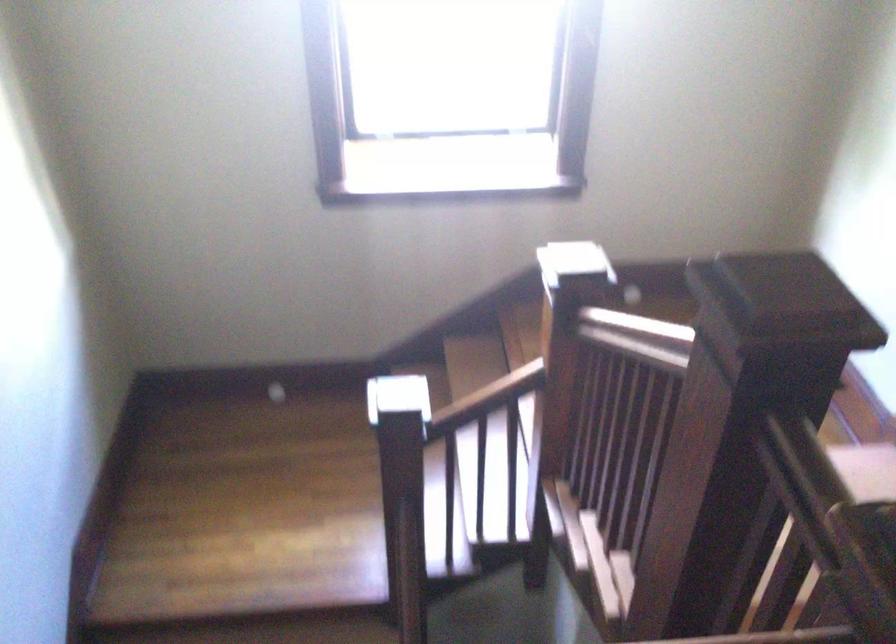
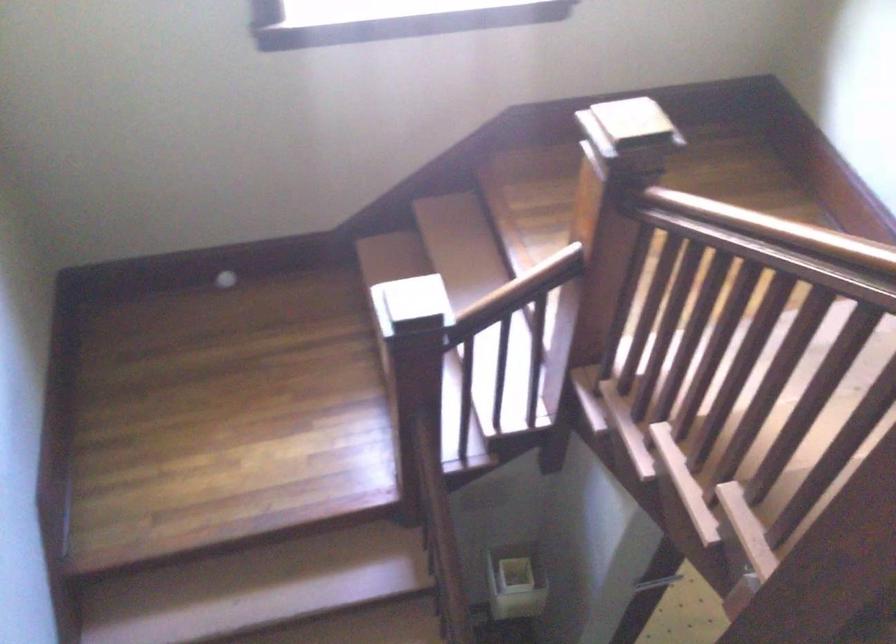
Looking at this image, the images are taken continuously from a first-person perspective. In which direction are you moving?

The cameraman moved toward left, forward.